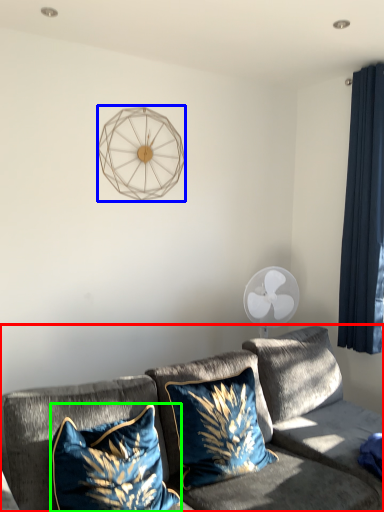
Question: Which object is the closest to the studio couch (highlighted by a red box)? Choose among these: lamp (highlighted by a blue box) or pillow (highlighted by a green box).

Choices:
 (A) lamp
 (B) pillow

Answer: (B)